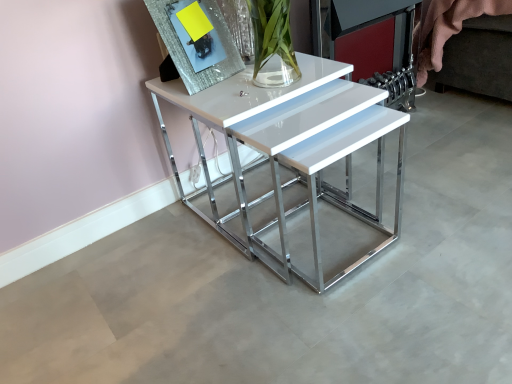
The height and width of the screenshot is (384, 512). I want to click on free location in front of sparkly silver picture frame at upper left, so click(229, 97).